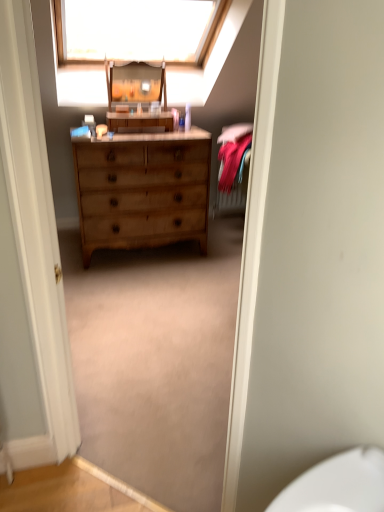
Where is `free space in front of light brown wood dresser at center`? This screenshot has height=512, width=384. free space in front of light brown wood dresser at center is located at coordinates (153, 294).